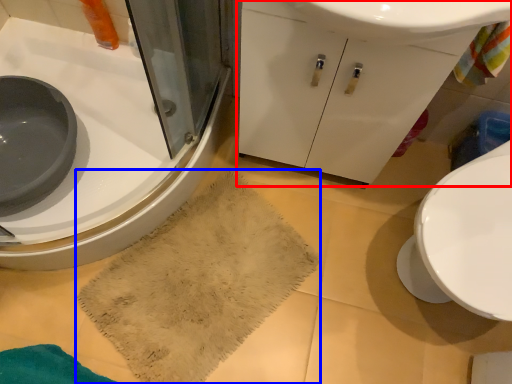
Question: Which object is further to the camera taking this photo, bathroom cabinet (highlighted by a red box) or bath towel (highlighted by a blue box)?

Choices:
 (A) bathroom cabinet
 (B) bath towel

Answer: (B)